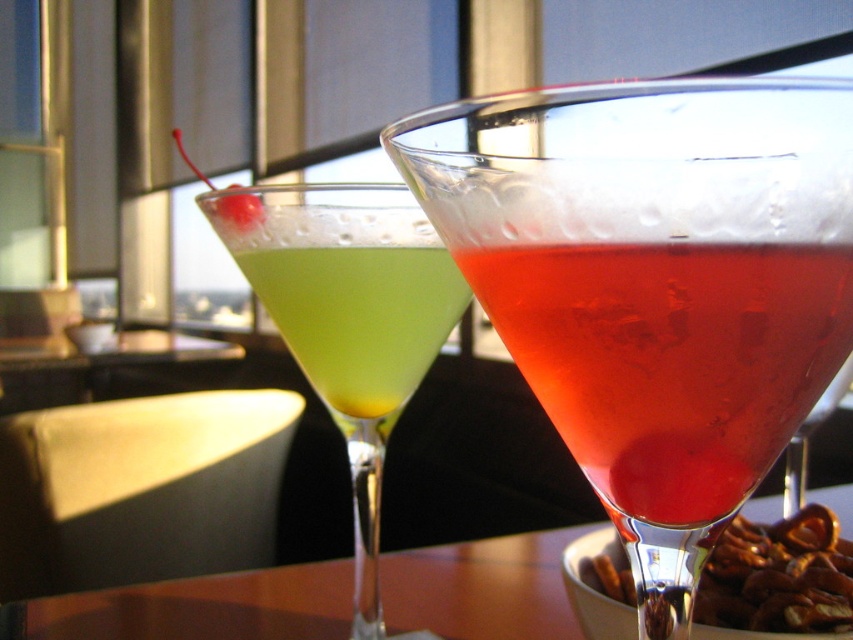
You are a bartender preparing drinks and need to place a coaster under the translucent glass cocktail at center and the green translucent liquid at center. Which drink requires a larger coaster to cover its base entirely?

The green translucent liquid at center requires a larger coaster because it has a greater width than the translucent glass cocktail at center.

You are a bartender who needs to place a new drink order on the table. The drink you have is 50 centimeters tall. Can you safely place it on the wooden table at center without it touching the translucent glass cocktail at center?

The translucent glass cocktail at center is 46.56 centimeters away from the wooden table at center. Since the new drink is 50 centimeters tall, placing it on the wooden table at center would result in the drink exceeding the height of the translucent glass cocktail at center by 3.44 centimeters. However, the question is about placement without touching. The distance given is between the cocktail and the table, not between the two drinks. Therefore, the vertical distance between the two drinks isn t provided

Based on the photo, you are a customer at a bar and want to reach for both drinks on the table. The first drink is at point [532,314] and the second is at point [241,221]. Which drink should you grab first if you want to avoid knocking over the other?

You should grab the drink at point [532,314] first because it is in front of the other drink at point [241,221], so reaching for it first would be safer and less likely to cause a disturbance.